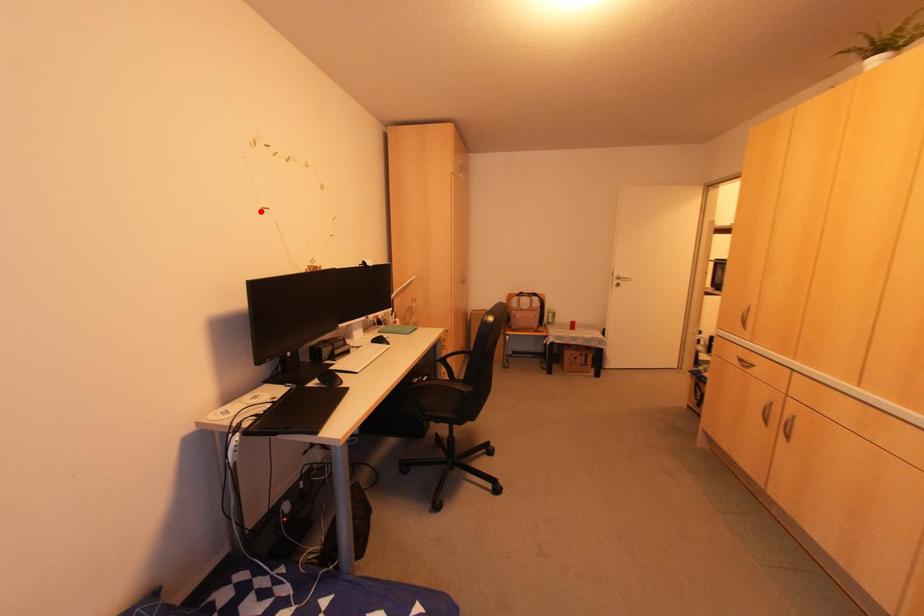
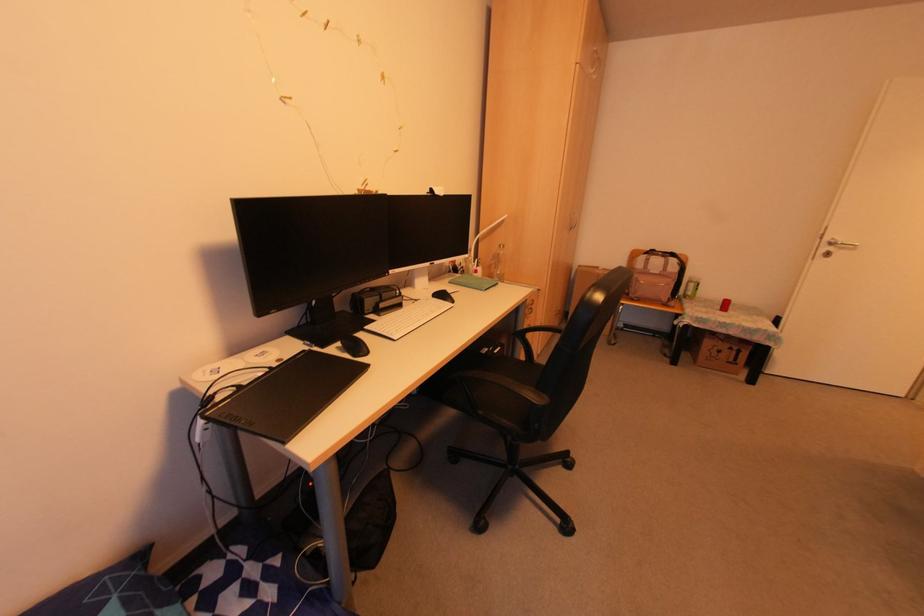
Find the pixel in the second image that matches the highlighted location in the first image.

(283, 103)